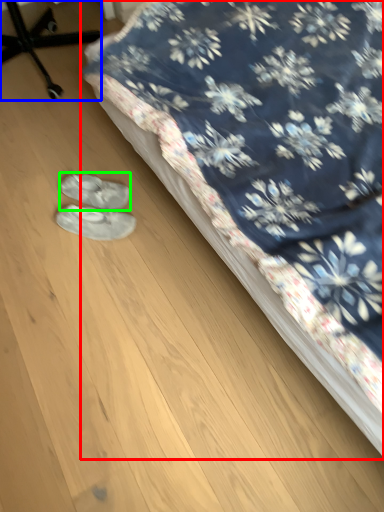
Question: Based on their relative distances, which object is farther from bed (highlighted by a red box)? Choose from furniture (highlighted by a blue box) and footwear (highlighted by a green box).

Choices:
 (A) furniture
 (B) footwear

Answer: (A)